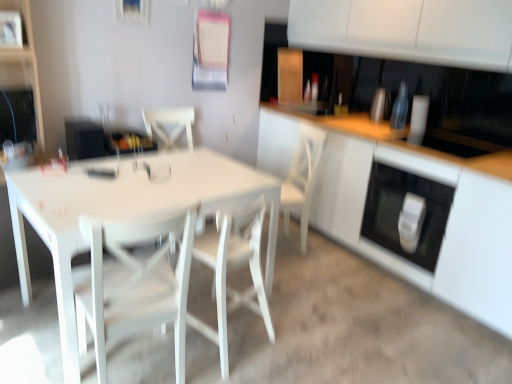
Image resolution: width=512 pixels, height=384 pixels. Identify the location of vacant region below white wood chair at center, the 1th chair from the right (from a real-world perspective). (x=231, y=332).